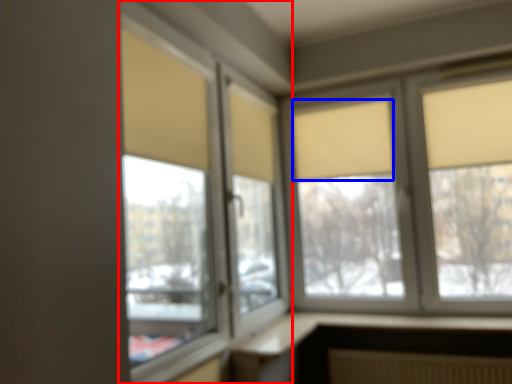
Question: Which object is closer to the camera taking this photo, window (highlighted by a red box) or curtain (highlighted by a blue box)?

Choices:
 (A) window
 (B) curtain

Answer: (A)